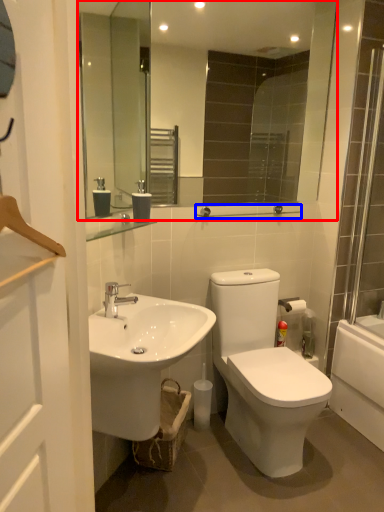
Question: Among these objects, which one is farthest to the camera, mirror (highlighted by a red box) or balustrade (highlighted by a blue box)?

Choices:
 (A) mirror
 (B) balustrade

Answer: (B)